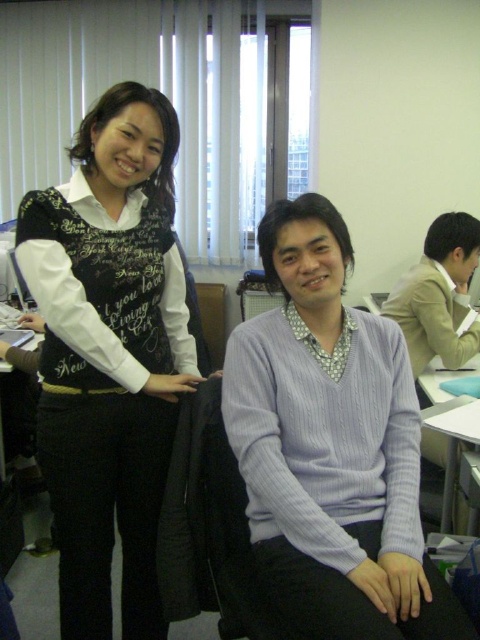
Question: Does black matte vest at left appear under purple ribbed sweater at center?

Choices:
 (A) no
 (B) yes

Answer: (A)

Question: Is purple ribbed sweater at center below light brown wool sweater at center?

Choices:
 (A) no
 (B) yes

Answer: (B)

Question: Is black matte vest at left closer to the viewer compared to purple ribbed sweater at center?

Choices:
 (A) yes
 (B) no

Answer: (B)

Question: Which object is farther from the camera taking this photo?

Choices:
 (A) black matte vest at left
 (B) purple ribbed sweater at center
 (C) light brown wool sweater at center

Answer: (C)

Question: Among these points, which one is nearest to the camera?

Choices:
 (A) (120, 355)
 (B) (471, 330)
 (C) (277, 589)

Answer: (C)

Question: Which object is the closest to the black matte vest at left?

Choices:
 (A) purple ribbed sweater at center
 (B) light brown wool sweater at center

Answer: (A)